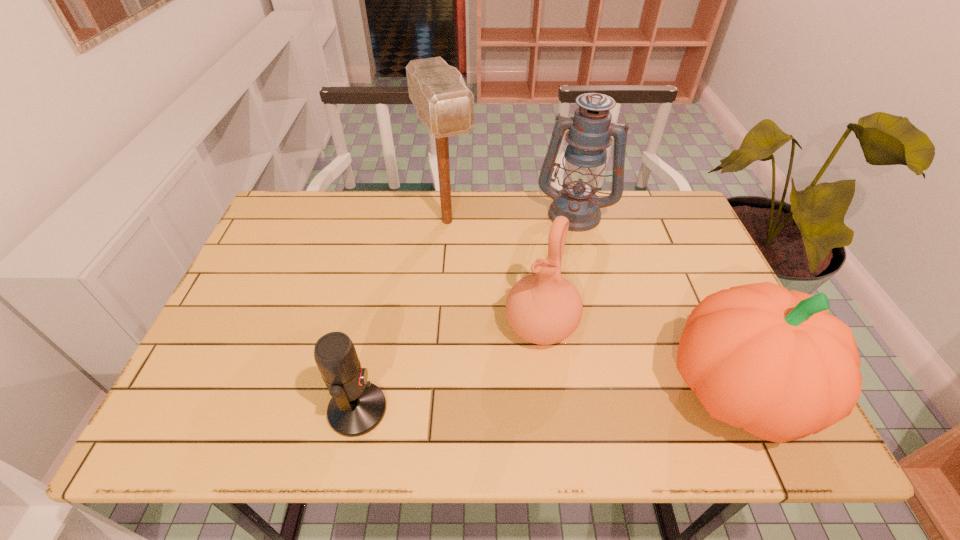
Image resolution: width=960 pixels, height=540 pixels. In order to click on free spot on the desktop that is between the shortest object and the pumpkin and is positioned on the striking face of the mallet in this screenshot , I will do `click(540, 401)`.

Where is `free spot on the desktop that is between the microphone and the pumpkin and is positioned on the front-facing side of the second tallest object`? free spot on the desktop that is between the microphone and the pumpkin and is positioned on the front-facing side of the second tallest object is located at coordinates (517, 402).

Where is `vacant space on the desktop that is between the shortest object and the pumpkin and is positioned on the spout of the pottery`? The image size is (960, 540). vacant space on the desktop that is between the shortest object and the pumpkin and is positioned on the spout of the pottery is located at coordinates (493, 403).